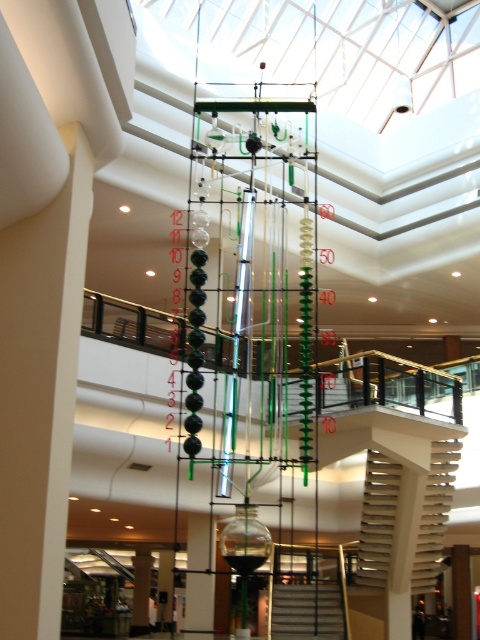
You are standing at the entrance of the mall and see two sets of stairs leading to the upper floor. The white textured stairs at center and the smooth white stairs at center. Which one is located to the right side?

The white textured stairs at center is to the right of the smooth white stairs at center, so the white textured stairs at center is located to the right side.

You are a person with mobility issues and need to choose between the white textured stairs at center and the smooth white stairs at center. Which stairs would be safer to use?

The white textured stairs at center are safer to use because textured surfaces provide better traction and reduce slipping risks compared to smooth surfaces.